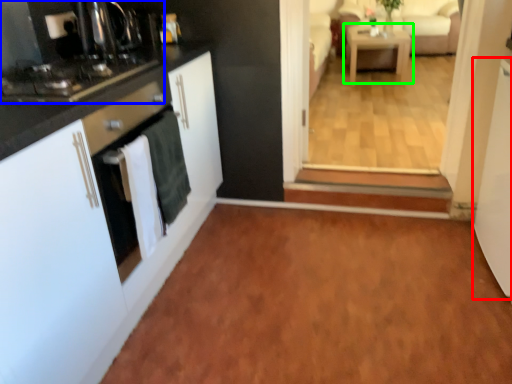
Question: Estimate the real-world distances between objects in this image. Which object is farther from screen door (highlighted by a red box), home appliance (highlighted by a blue box) or table (highlighted by a green box)?

Choices:
 (A) home appliance
 (B) table

Answer: (B)